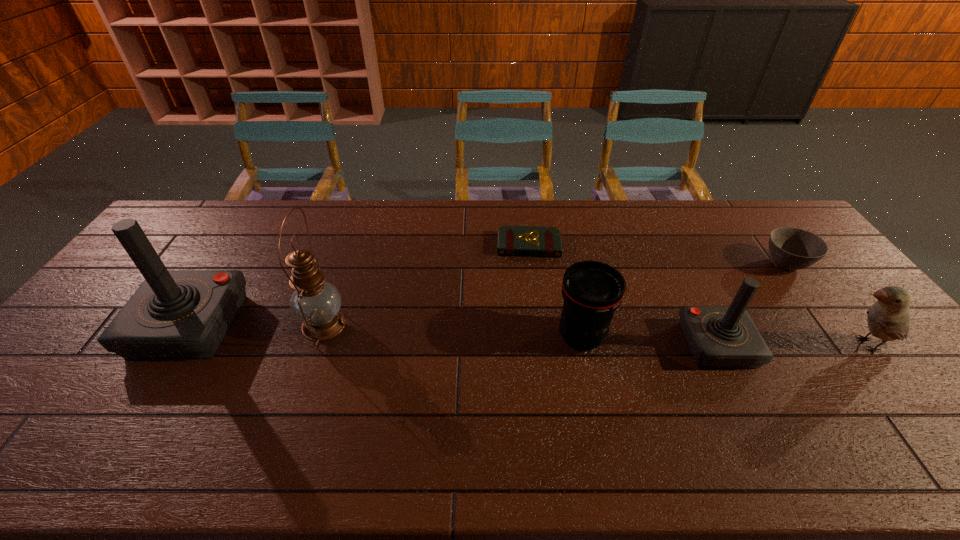
At what (x,y) coordinates should I click in order to perform the action: click on free region located 0.190m on the back of the second shortest object. Please return your answer as a coordinate pair (x, y). The width and height of the screenshot is (960, 540). Looking at the image, I should click on (749, 215).

In order to click on free space located 0.360m on the left of the oil lamp in this screenshot , I will do `click(171, 325)`.

Where is `vacant region located 0.360m on the front of the book`? vacant region located 0.360m on the front of the book is located at coordinates (541, 347).

This screenshot has height=540, width=960. Find the location of `vacant area situated on the back of the telephoto lens`. vacant area situated on the back of the telephoto lens is located at coordinates (563, 249).

Identify the location of free location located 0.380m at the face of the bird. (689, 345).

This screenshot has width=960, height=540. Identify the location of vacant point located 0.090m at the face of the bird. (798, 345).

I want to click on vacant space located 0.100m at the face of the bird, so click(x=794, y=345).

The image size is (960, 540). Identify the location of object that is at the far edge. (512, 240).

Locate an element on the screen. The width and height of the screenshot is (960, 540). bowl that is positioned at the right edge is located at coordinates (791, 248).

At what (x,y) coordinates should I click in order to perform the action: click on bird situated at the right edge. Please return your answer as a coordinate pair (x, y). This screenshot has width=960, height=540. Looking at the image, I should click on (889, 318).